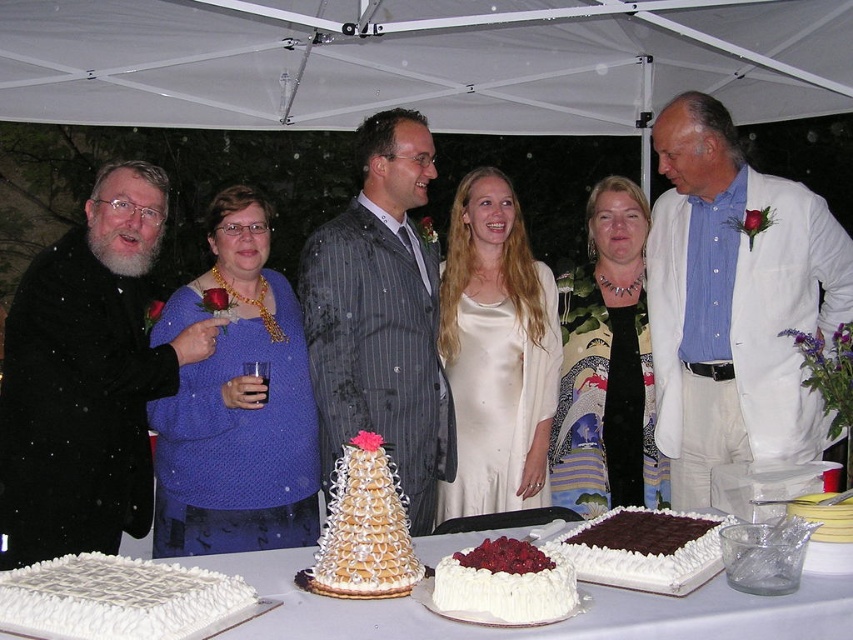
You are a photographer at the event and need to capture a photo that includes both the white fabric canopy at upper center and the printed silk scarf at center. What is the minimum distance you need to move backward to ensure both objects are in frame?

The white fabric canopy at upper center and printed silk scarf at center are 1.26 meters apart. To ensure both are in frame, you need to move back at least 1.26 meters to accommodate their separation.

You are a photographer at the event and need to capture a group photo. The white cotton suit at center and the printed silk scarf at center are both in the frame. Which object is wider?

The white cotton suit at center is wider than the printed silk scarf at center.